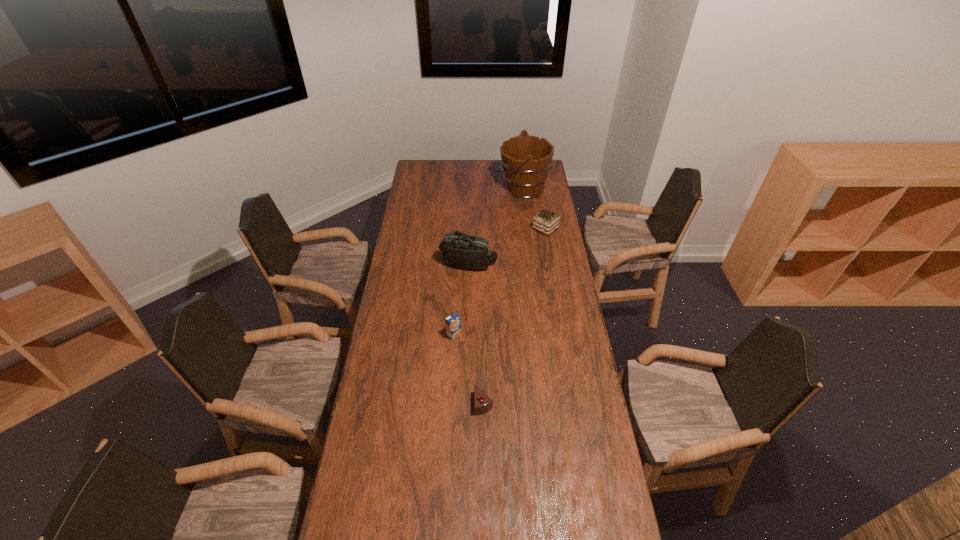
In the image, there is a desktop. At what (x,y) coordinates should I click in order to perform the action: click on free space at the left edge. Please return your answer as a coordinate pair (x, y). This screenshot has width=960, height=540. Looking at the image, I should click on (428, 197).

Where is `free region at the right edge of the desktop`? The width and height of the screenshot is (960, 540). free region at the right edge of the desktop is located at coordinates (558, 363).

Identify the location of free space at the far left corner of the desktop. Image resolution: width=960 pixels, height=540 pixels. (433, 180).

This screenshot has height=540, width=960. Identify the location of vacant area between the tallest object and the shoulder bag. (496, 226).

Locate an element on the screen. The height and width of the screenshot is (540, 960). free space that is in between the orange_juice and the third farthest object is located at coordinates (461, 299).

Find the location of `vacant area that lies between the right chocolate cake and the shoulder bag`. vacant area that lies between the right chocolate cake and the shoulder bag is located at coordinates (507, 246).

The image size is (960, 540). What are the coordinates of `free space that is in between the farthest object and the third nearest object` in the screenshot? It's located at (496, 226).

You are a GUI agent. You are given a task and a screenshot of the screen. Output one action in this format:
    pyautogui.click(x=<x>, y=<y>)
    Task: Click on the free space between the shortest object and the right chocolate cake
    
    Given the screenshot: What is the action you would take?
    pyautogui.click(x=515, y=316)

You are a GUI agent. You are given a task and a screenshot of the screen. Output one action in this format:
    pyautogui.click(x=<x>, y=<y>)
    Task: Click on the empty location between the nearest object and the orange_juice
    This screenshot has width=960, height=540.
    Given the screenshot: What is the action you would take?
    pyautogui.click(x=468, y=369)

The width and height of the screenshot is (960, 540). What are the coordinates of `empty location between the left chocolate cake and the fourth nearest object` in the screenshot? It's located at (515, 316).